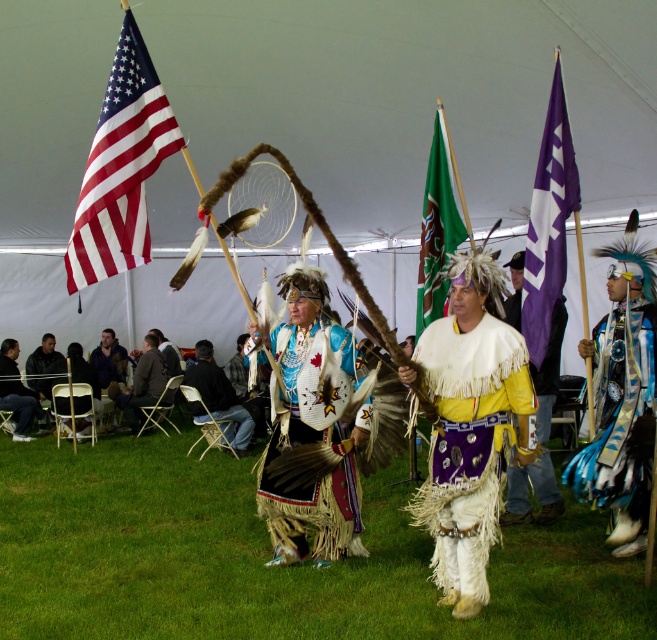
You are an event photographer at the cultural event. You need to capture a photo that includes both the beige fringed skirt at center and the blue feathered headdress at right. Which of these two items will appear smaller in the final photo?

The beige fringed skirt at center will appear smaller in the final photo because it occupies less space than the blue feathered headdress at right.

You are attending a cultural event and see the yellow leather vest at center and the green fabric flag at center. Which object is positioned to the right?

The yellow leather vest at center is to the right of the green fabric flag at center.

You are a photographer standing at the edge of the tent. You want to capture a photo that includes both the yellow leather vest at center and the green fabric flag at center. The camera you are using has a maximum focus range of 30 inches. Will you be able to fit both objects in the frame without moving closer?

The distance between the yellow leather vest at center and the green fabric flag at center is 30.99 inches. Since the camera can only focus up to 30 inches, the objects are slightly out of range. You might need to move closer to ensure both are in focus.